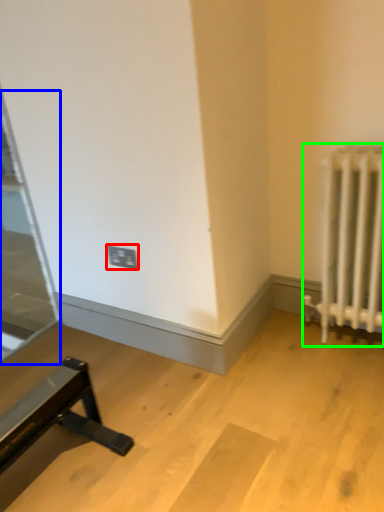
Question: Considering the real-world distances, which object is farthest from electric outlet (highlighted by a red box)? glass door (highlighted by a blue box) or radiator (highlighted by a green box)?

Choices:
 (A) glass door
 (B) radiator

Answer: (A)